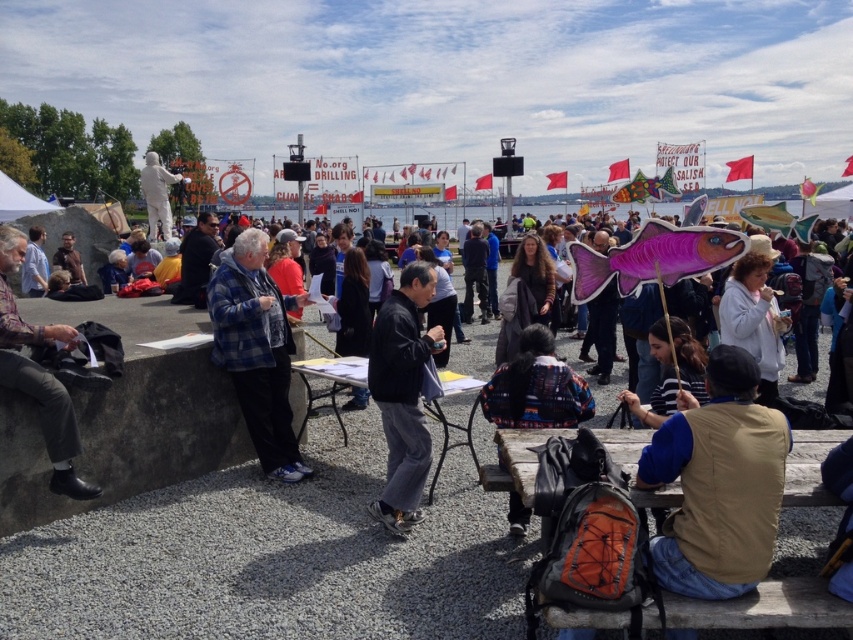
Is the position of brown suede vest at lower right more distant than that of black leather jacket at center?

No, brown suede vest at lower right is closer to the viewer.

Is brown suede vest at lower right shorter than black leather jacket at center?

Indeed, brown suede vest at lower right has a lesser height compared to black leather jacket at center.

At what (x,y) coordinates should I click in order to perform the action: click on brown suede vest at lower right. Please return your answer as a coordinate pair (x, y). This screenshot has height=640, width=853. Looking at the image, I should click on (718, 483).

Can you confirm if blue plaid shirt at center is positioned above black leather jacket at center?

Correct, blue plaid shirt at center is located above black leather jacket at center.

Between point (230, 298) and point (370, 369), which one is positioned in front?

Point (370, 369) is more forward.

Who is more forward, (244, 380) or (403, 483)?

Point (403, 483)

Find the location of a particular element. This screenshot has width=853, height=640. blue plaid shirt at center is located at coordinates (257, 349).

Does black leather jacket at center have a larger size compared to dark gray pants at left?

Yes, black leather jacket at center is bigger than dark gray pants at left.

Does black leather jacket at center appear on the left side of dark gray pants at left?

Incorrect, black leather jacket at center is not on the left side of dark gray pants at left.

Identify the location of black leather jacket at center. This screenshot has height=640, width=853. (402, 394).